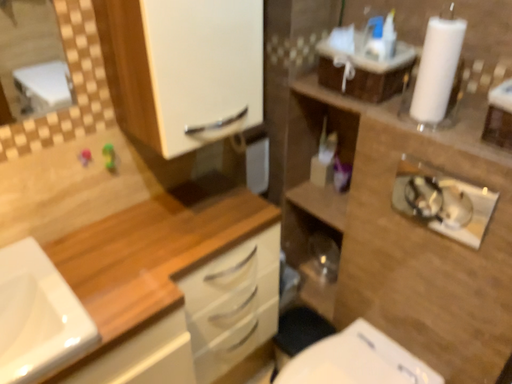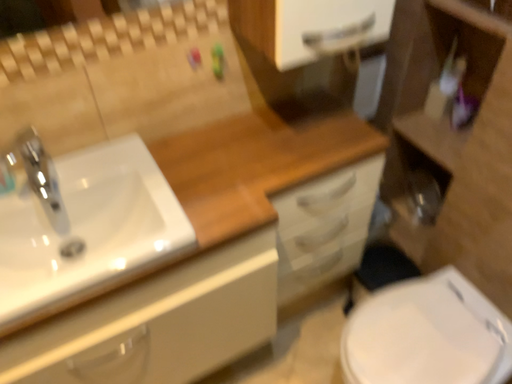
Question: How did the camera likely rotate when shooting the video?

Choices:
 (A) rotated right
 (B) rotated left

Answer: (B)